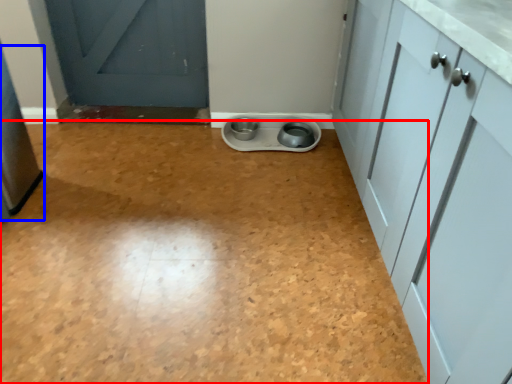
Question: Which object appears closest to the camera in this image, plain (highlighted by a red box) or appliance (highlighted by a blue box)?

Choices:
 (A) plain
 (B) appliance

Answer: (A)